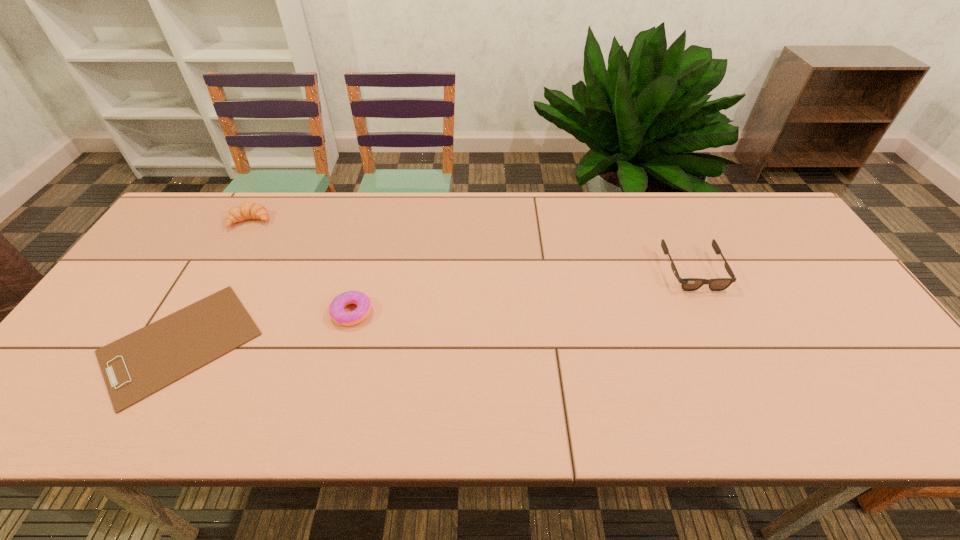
This screenshot has height=540, width=960. Identify the location of empty location between the shortest object and the sunglasses. (437, 307).

The width and height of the screenshot is (960, 540). In order to click on vacant space that's between the third object from left to right and the sunglasses in this screenshot , I will do `click(522, 292)`.

You are a GUI agent. You are given a task and a screenshot of the screen. Output one action in this format:
    pyautogui.click(x=<x>, y=<y>)
    Task: Click on the free area in between the shortest object and the sunglasses
    The width and height of the screenshot is (960, 540).
    Given the screenshot: What is the action you would take?
    coord(437,307)

You are a GUI agent. You are given a task and a screenshot of the screen. Output one action in this format:
    pyautogui.click(x=<x>, y=<y>)
    Task: Click on the free space between the clipboard and the farthest object
    
    Given the screenshot: What is the action you would take?
    pyautogui.click(x=215, y=282)

Locate an element on the screen. The height and width of the screenshot is (540, 960). unoccupied area between the rightmost object and the doughnut is located at coordinates (522, 292).

I want to click on free space between the rightmost object and the crescent roll, so click(x=471, y=246).

In order to click on vacant region between the farthest object and the clipboard in this screenshot , I will do `click(215, 282)`.

You are a GUI agent. You are given a task and a screenshot of the screen. Output one action in this format:
    pyautogui.click(x=<x>, y=<y>)
    Task: Click on the vacant space that's between the third object from left to right and the rightmost object
    
    Given the screenshot: What is the action you would take?
    pyautogui.click(x=522, y=292)

Find the location of a particular element. The width and height of the screenshot is (960, 540). vacant area between the second shortest object and the farthest object is located at coordinates (300, 267).

This screenshot has height=540, width=960. I want to click on object that stands as the second closest to the second object from right to left, so click(x=247, y=210).